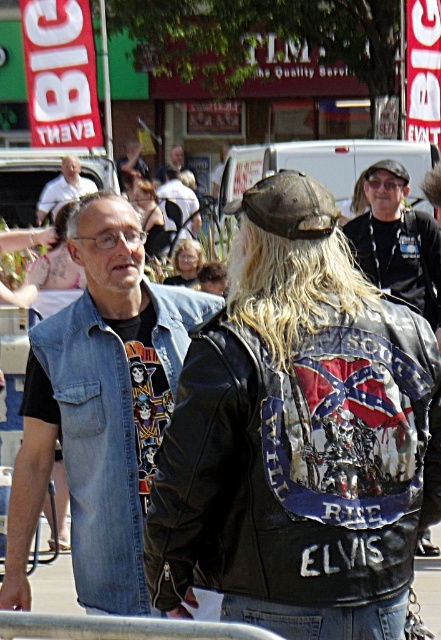
You are at an outdoor event and see two jackets hanging on a rack. The black leather jacket at center and the light brown leather jacket at center. Which one is positioned to the right?

The black leather jacket at center is positioned to the right of the light brown leather jacket at center.